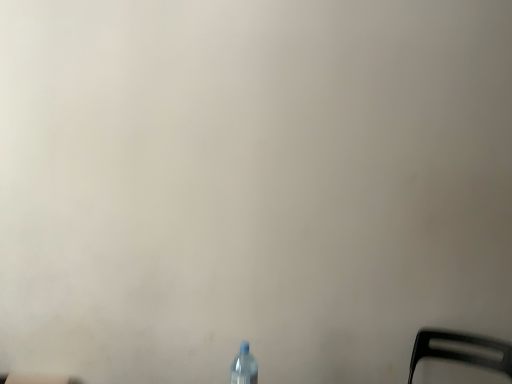
Question: Is black plastic chair at lower right positioned with its back to transparent plastic bottle at lower center?

Choices:
 (A) no
 (B) yes

Answer: (A)

Question: Considering the relative positions of black plastic chair at lower right and transparent plastic bottle at lower center in the image provided, is black plastic chair at lower right to the right of transparent plastic bottle at lower center from the viewer's perspective?

Choices:
 (A) yes
 (B) no

Answer: (A)

Question: Is black plastic chair at lower right next to transparent plastic bottle at lower center and touching it?

Choices:
 (A) yes
 (B) no

Answer: (B)

Question: Considering the relative sizes of black plastic chair at lower right and transparent plastic bottle at lower center in the image provided, is black plastic chair at lower right shorter than transparent plastic bottle at lower center?

Choices:
 (A) yes
 (B) no

Answer: (A)

Question: From the image's perspective, is black plastic chair at lower right under transparent plastic bottle at lower center?

Choices:
 (A) yes
 (B) no

Answer: (A)

Question: Is black plastic chair at lower right outside of transparent plastic bottle at lower center?

Choices:
 (A) yes
 (B) no

Answer: (A)

Question: From the image's perspective, is transparent plastic bottle at lower center above black plastic chair at lower right?

Choices:
 (A) yes
 (B) no

Answer: (A)

Question: Is transparent plastic bottle at lower center not within black plastic chair at lower right?

Choices:
 (A) no
 (B) yes

Answer: (B)

Question: Is the depth of transparent plastic bottle at lower center less than that of black plastic chair at lower right?

Choices:
 (A) no
 (B) yes

Answer: (B)

Question: Is transparent plastic bottle at lower center taller than black plastic chair at lower right?

Choices:
 (A) no
 (B) yes

Answer: (B)

Question: Considering the relative positions of transparent plastic bottle at lower center and black plastic chair at lower right in the image provided, is transparent plastic bottle at lower center to the left of black plastic chair at lower right from the viewer's perspective?

Choices:
 (A) yes
 (B) no

Answer: (A)

Question: Are transparent plastic bottle at lower center and black plastic chair at lower right making contact?

Choices:
 (A) yes
 (B) no

Answer: (B)

Question: Considering the positions of black plastic chair at lower right and transparent plastic bottle at lower center in the image, is black plastic chair at lower right taller or shorter than transparent plastic bottle at lower center?

Choices:
 (A) short
 (B) tall

Answer: (A)